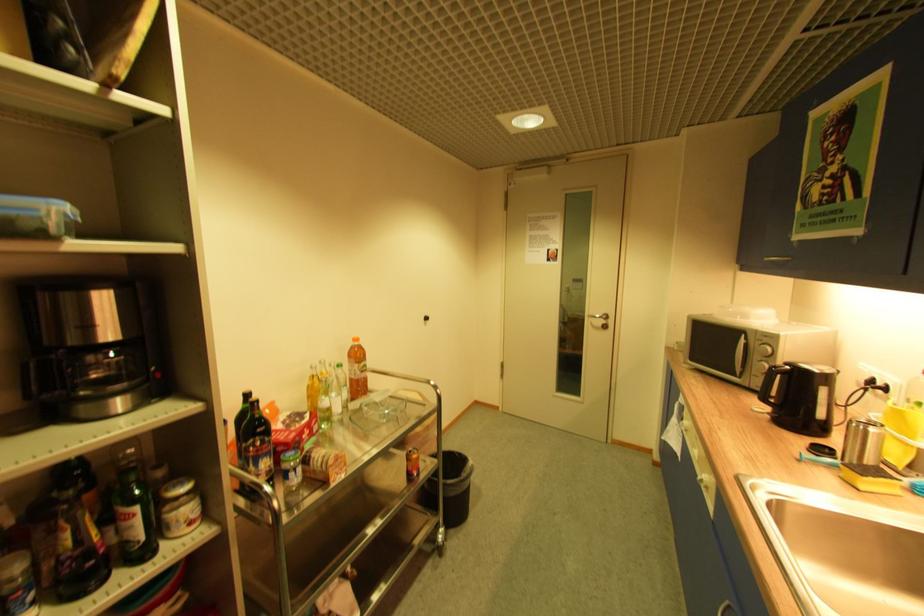
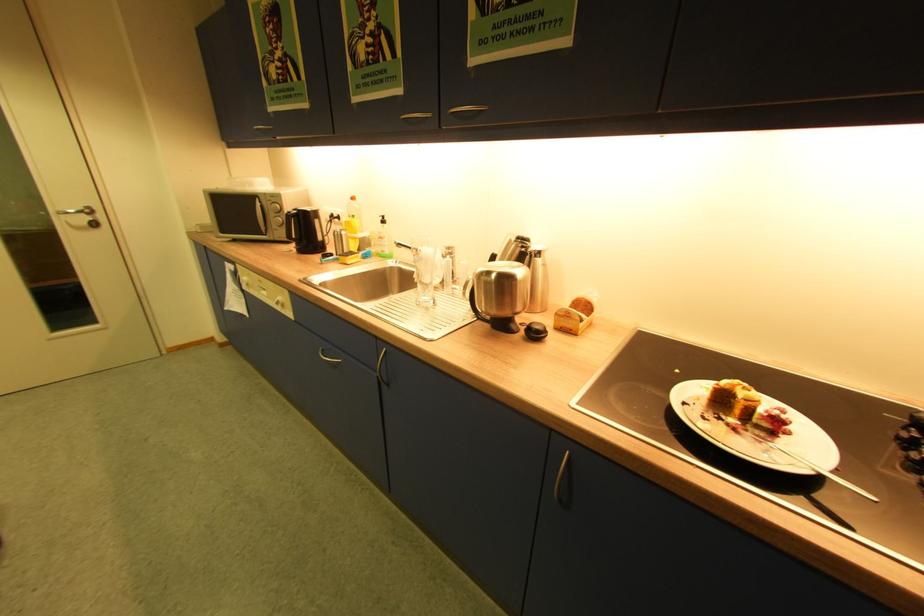
Question: I am providing you with two images of the same scene from different viewpoints. Which of the following objects are not visible in image2?

Choices:
 (A) soap dispenser pump
 (B) glass cup
 (C) silver door handle
 (D) none of these

Answer: (D)